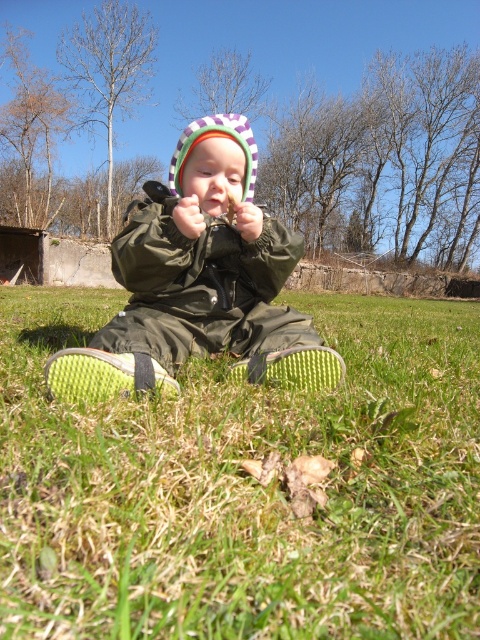
Question: Is green grass at lower center above green rubber boots at center?

Choices:
 (A) yes
 (B) no

Answer: (B)

Question: Is green grass at lower center further to the viewer compared to green rubber shoe at lower left?

Choices:
 (A) yes
 (B) no

Answer: (B)

Question: Which of the following is the farthest from the observer?

Choices:
 (A) (236, 220)
 (B) (59, 387)

Answer: (A)

Question: Which object is farther from the camera taking this photo?

Choices:
 (A) green grass at lower center
 (B) green rubber boots at center
 (C) green rubber shoe at lower left
 (D) green textured shoe at lower center

Answer: (D)

Question: Which of the following is the farthest from the observer?

Choices:
 (A) green rubber boots at center
 (B) green grass at lower center
 (C) green rubber shoe at lower left

Answer: (A)

Question: Does green grass at lower center come in front of green textured shoe at lower center?

Choices:
 (A) yes
 (B) no

Answer: (A)